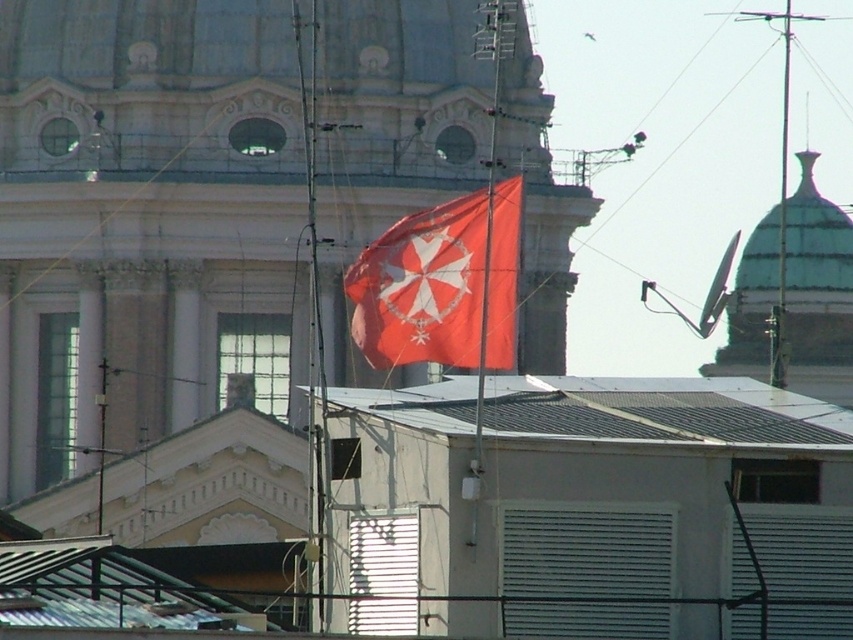
In the scene shown: Can you confirm if smooth stone dome at upper center is wider than gray metal roof at center?

Yes.

Which of these two, smooth stone dome at upper center or gray metal roof at center, stands shorter?

gray metal roof at center is shorter.

Is point (137, 54) less distant than point (558, 422)?

No, it is not.

At what (x,y) coordinates should I click in order to perform the action: click on smooth stone dome at upper center. Please return your answer as a coordinate pair (x, y). Looking at the image, I should click on (143, 40).

Which is behind, point (73, 68) or point (425, 240)?

Positioned behind is point (73, 68).

Does point (1, 64) come behind point (381, 324)?

Yes.

You are a GUI agent. You are given a task and a screenshot of the screen. Output one action in this format:
    pyautogui.click(x=<x>, y=<y>)
    Task: Click on the smooth stone dome at upper center
    
    Given the screenshot: What is the action you would take?
    pyautogui.click(x=143, y=40)

Based on the photo, between smooth stone dome at upper center and green glazed dome at upper right, which one is positioned higher?

smooth stone dome at upper center is above.

Can you confirm if smooth stone dome at upper center is wider than green glazed dome at upper right?

Indeed, smooth stone dome at upper center has a greater width compared to green glazed dome at upper right.

Does point (534, 58) come in front of point (741, 285)?

Yes, point (534, 58) is in front of point (741, 285).

You are a GUI agent. You are given a task and a screenshot of the screen. Output one action in this format:
    pyautogui.click(x=<x>, y=<y>)
    Task: Click on the smooth stone dome at upper center
    This screenshot has height=640, width=853.
    Given the screenshot: What is the action you would take?
    pyautogui.click(x=143, y=40)